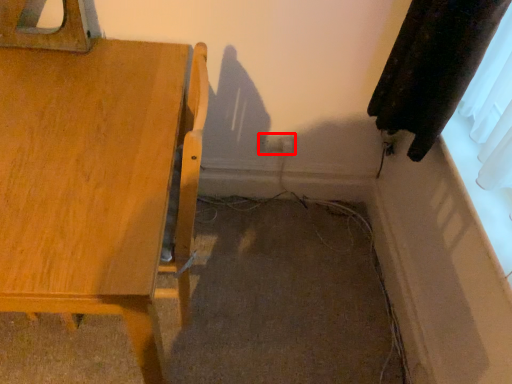
Question: From the image's perspective, what is the correct spatial positioning of electric outlet (annotated by the red box) in reference to furniture?

Choices:
 (A) below
 (B) above

Answer: (B)